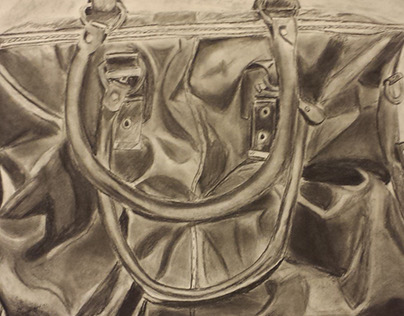
This screenshot has height=316, width=404. Find the location of `lower handle`. lower handle is located at coordinates (210, 288).